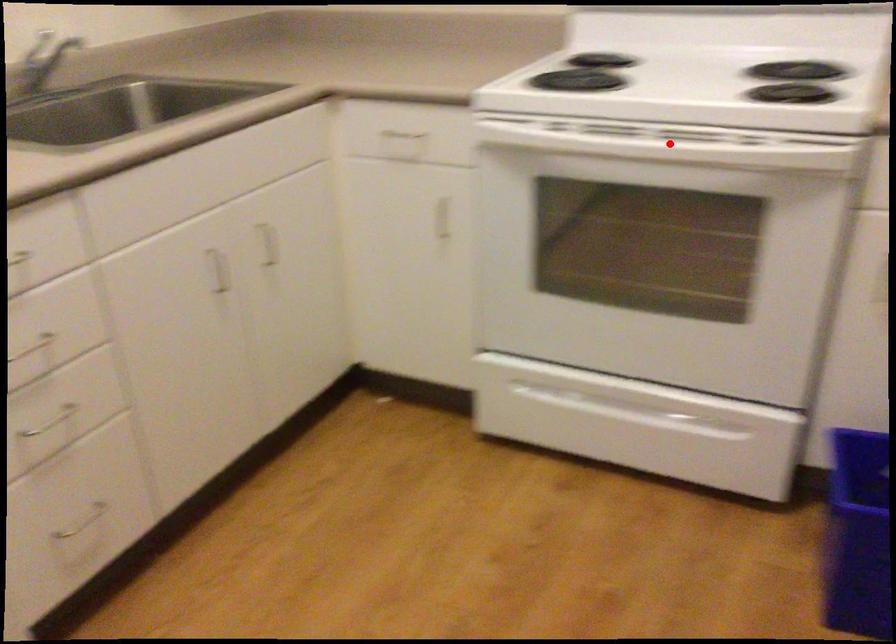
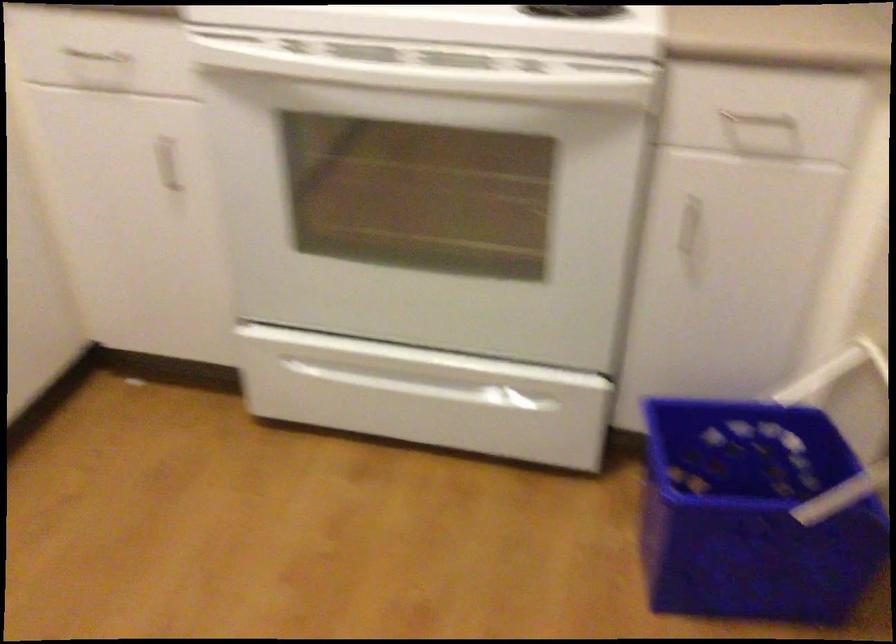
Question: I am providing you with two images of the same scene from different viewpoints. A red point is shown in image1. For the corresponding object point in image2, is it positioned nearer or farther from the camera?

Choices:
 (A) Nearer
 (B) Farther

Answer: (A)